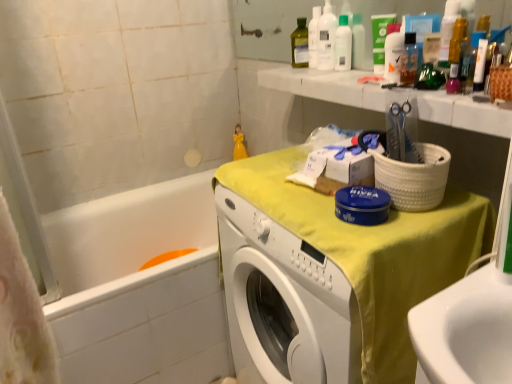
Question: Considering the positions of white glossy bottle at upper center, which is the second cleaning product in left-to-right order, and green matte tube at upper center in the image, is white glossy bottle at upper center, which is the second cleaning product in left-to-right order, wider or thinner than green matte tube at upper center?

Choices:
 (A) wide
 (B) thin

Answer: (B)

Question: From the image's perspective, relative to green matte tube at upper center, is white glossy bottle at upper center, the 1th cleaning product positioned from the right, above or below?

Choices:
 (A) above
 (B) below

Answer: (B)

Question: Which of these objects is positioned farthest from the white plastic bottles at upper center, which ranks as the 1th cleaning product in back-to-front order?

Choices:
 (A) white plastic bottle at upper center
 (B) white marble counter top at upper right
 (C) white glossy bottle at upper center, the 1th cleaning product positioned from the right
 (D) clear plastic bottle at upper center
 (E) white glossy bathtub at lower left

Answer: (E)

Question: Considering the real-world distances, which object is farthest from the clear plastic bottle at upper center?

Choices:
 (A) white glossy bottle at upper center, the 1th cleaning product positioned from the right
 (B) white plastic bottle at upper center
 (C) white marble counter top at upper right
 (D) yellow fabric-covered washer at center
 (E) white glossy bathtub at lower left

Answer: (E)